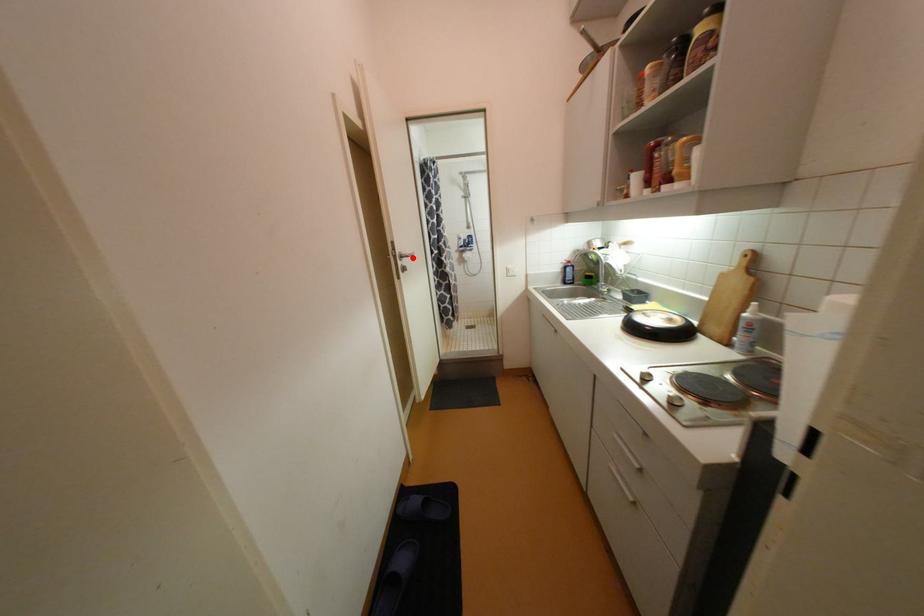
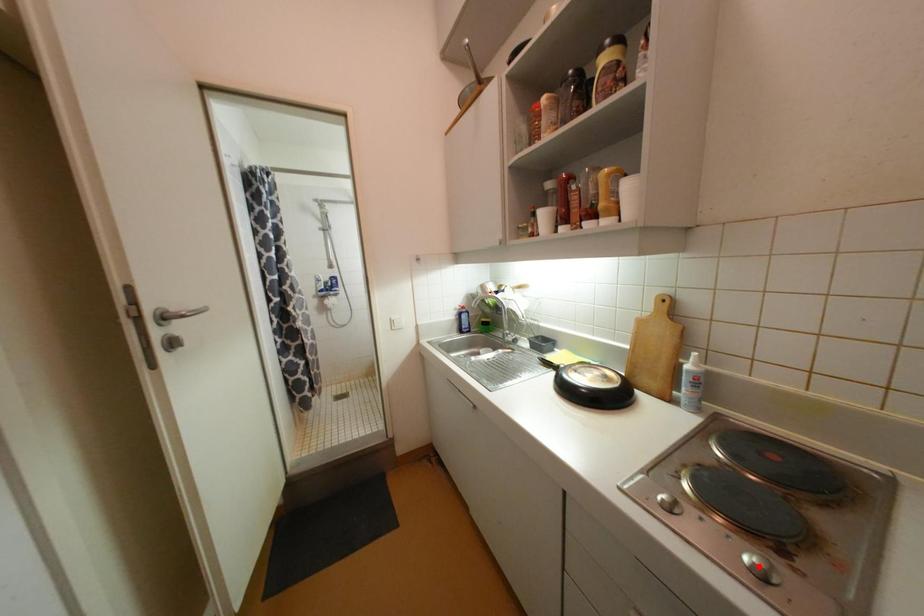
I am providing you with two images of the same scene from different viewpoints. A red point is marked on the first image and another point is marked on the second image. Does the point marked in image1 correspond to the same location as the one in image2?

No